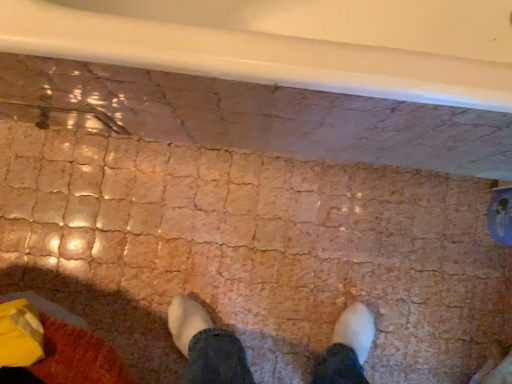
This screenshot has width=512, height=384. Identify the location of matte concrete bathtub at upper center. (288, 43).

Measure the distance between matte concrete bathtub at upper center and camera.

A distance of 19.31 inches exists between matte concrete bathtub at upper center and camera.

Image resolution: width=512 pixels, height=384 pixels. Describe the element at coordinates (288, 43) in the screenshot. I see `matte concrete bathtub at upper center` at that location.

Locate an element on the screen. matte concrete bathtub at upper center is located at coordinates (288, 43).